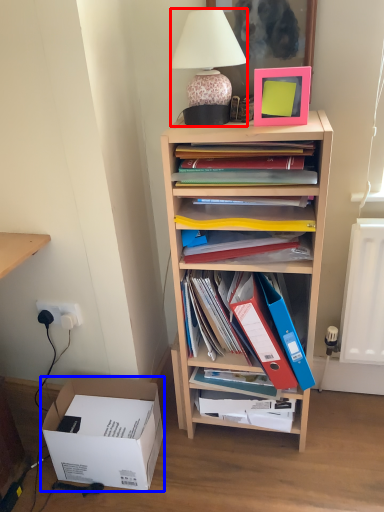
Question: Among these objects, which one is farthest to the camera, lamp (highlighted by a red box) or box (highlighted by a blue box)?

Choices:
 (A) lamp
 (B) box

Answer: (B)